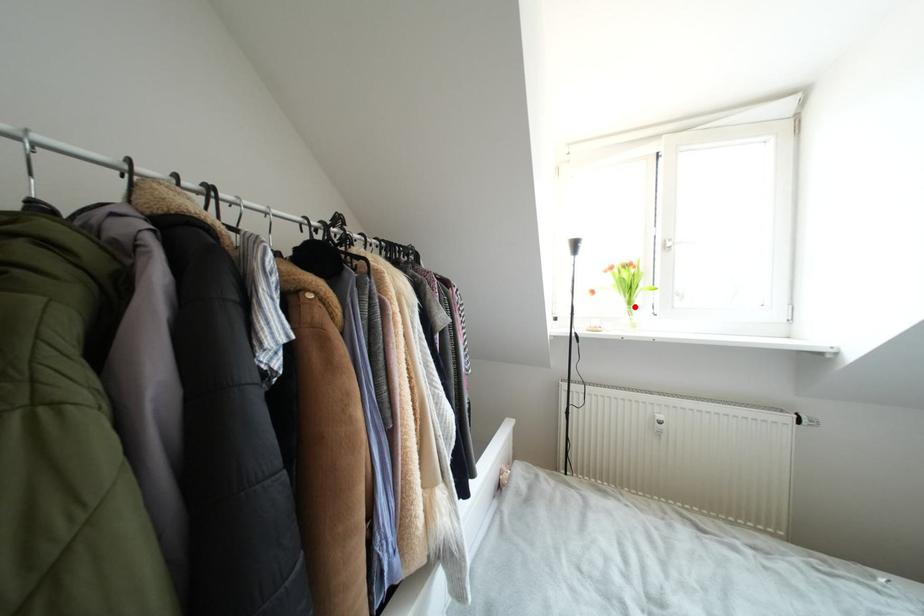
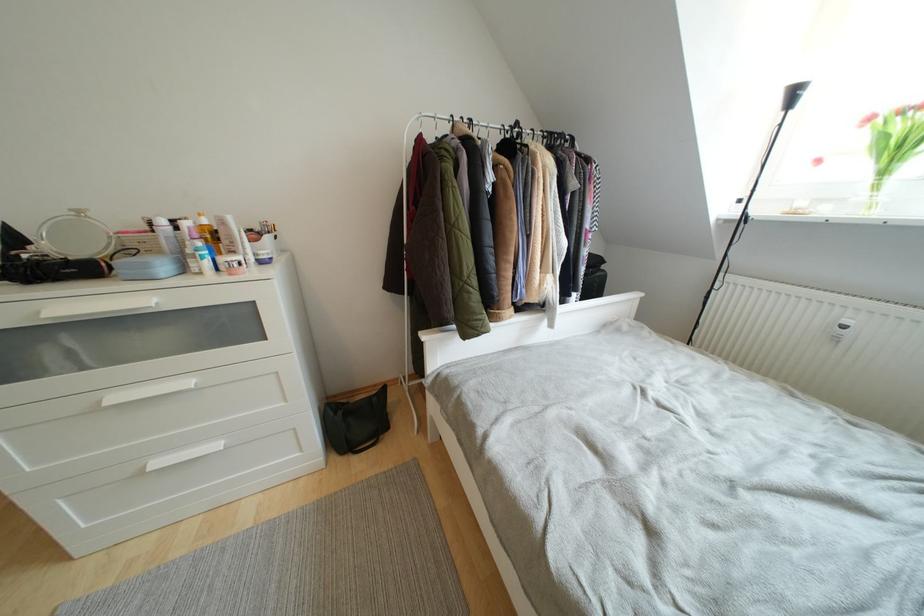
Question: I am providing you with two images of the same scene from different viewpoints. Image1 has a red point marked. In image2, the corresponding 3D location appears at what relative position? Reply with the corresponding letter.

Choices:
 (A) Closer
 (B) Farther

Answer: (B)